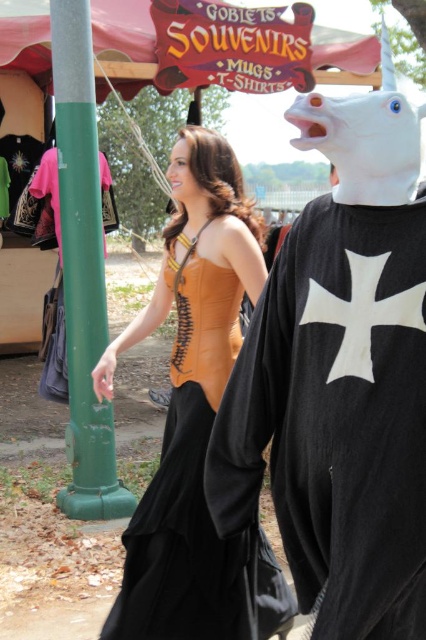
Can you confirm if white matte unicorn head at right is positioned to the left of leather-like orange corset at center?

No, white matte unicorn head at right is not to the left of leather-like orange corset at center.

Does white matte unicorn head at right have a greater height compared to leather-like orange corset at center?

Incorrect, white matte unicorn head at right's height is not larger of leather-like orange corset at center's.

The width and height of the screenshot is (426, 640). What do you see at coordinates (340, 380) in the screenshot? I see `white matte unicorn head at right` at bounding box center [340, 380].

Where is `white matte unicorn head at right`? white matte unicorn head at right is located at coordinates (340, 380).